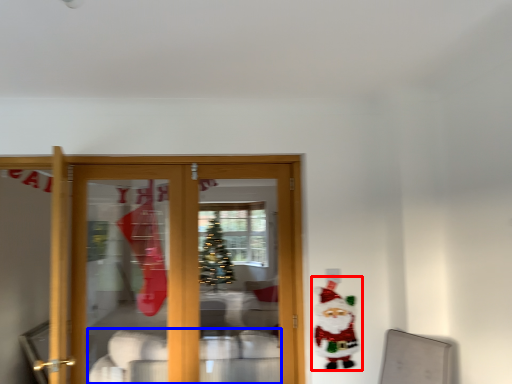
Question: Which object is closer to the camera taking this photo, santa claus (highlighted by a red box) or furniture (highlighted by a blue box)?

Choices:
 (A) santa claus
 (B) furniture

Answer: (A)